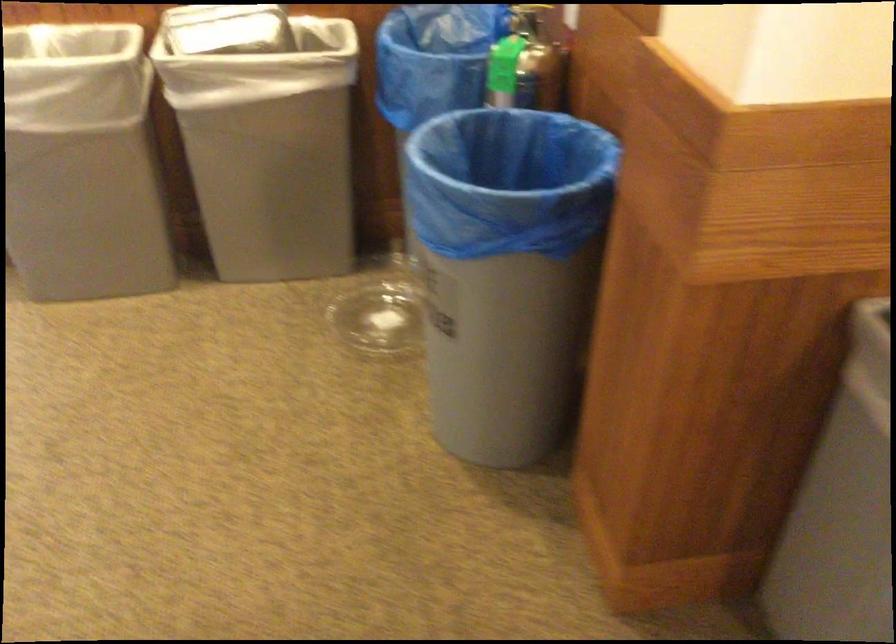
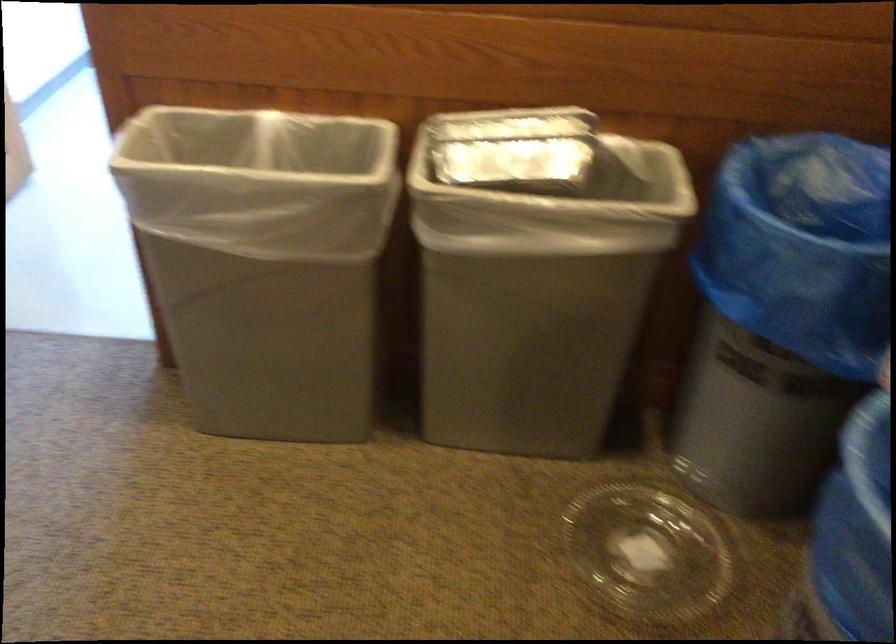
Question: The first image is from the beginning of the video and the second image is from the end. How did the camera likely rotate when shooting the video?

Choices:
 (A) Left
 (B) Right
 (C) Up
 (D) Down

Answer: (A)